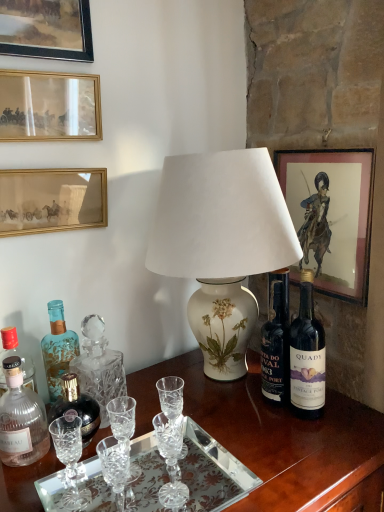
What do you see at coordinates (21, 419) in the screenshot? I see `translucent glass bottle at left, the third bottle viewed from the back` at bounding box center [21, 419].

What is the approximate width of wooden desk at center?

wooden desk at center is 26.33 inches in width.

The height and width of the screenshot is (512, 384). Describe the element at coordinates (212, 472) in the screenshot. I see `clear glass tray at lower center` at that location.

In order to face dark glass bottle at right, should I rotate leftwards or rightwards?

You should rotate right by 15.108 degrees.

Locate an element on the screen. blue glass bottle at left, the third bottle viewed from the front is located at coordinates (58, 349).

Identify the location of translucent glass bottle at left, marked as the 1th bottle in a front-to-back arrangement. (21, 419).

Is gold-framed picture at upper left, the 3th picture frame positioned from the left, looking in the opposite direction of wooden desk at center?

No, gold-framed picture at upper left, the 3th picture frame positioned from the left, is not facing away from wooden desk at center.

How far apart are gold-framed picture at upper left, arranged as the second picture frame when viewed from the right, and wooden desk at center?

gold-framed picture at upper left, arranged as the second picture frame when viewed from the right, and wooden desk at center are 23.17 inches apart from each other.

From the image's perspective, is gold-framed picture at upper left, the 3th picture frame positioned from the left, on wooden desk at center?

Indeed, from the image's perspective, gold-framed picture at upper left, the 3th picture frame positioned from the left, is shown above wooden desk at center.

Is clear crystal wine glass at center outside of gold-framed picture at upper left, the 3th picture frame positioned from the left?

clear crystal wine glass at center is positioned outside gold-framed picture at upper left, the 3th picture frame positioned from the left.

Is clear crystal wine glass at center at the left side of gold-framed picture at upper left, the 3th picture frame positioned from the left?

No, clear crystal wine glass at center is not to the left of gold-framed picture at upper left, the 3th picture frame positioned from the left.

Looking at their sizes, would you say clear crystal wine glass at center is wider or thinner than gold-framed picture at upper left, arranged as the second picture frame when viewed from the right?

Considering their sizes, clear crystal wine glass at center looks broader than gold-framed picture at upper left, arranged as the second picture frame when viewed from the right.

Is wooden picture frame at upper left, marked as the 4th picture frame in a right-to-left arrangement, completely or partially inside gold-framed picture at upper left, the 3th picture frame positioned from the left?

No, wooden picture frame at upper left, marked as the 4th picture frame in a right-to-left arrangement, is not surrounded by gold-framed picture at upper left, the 3th picture frame positioned from the left.

From a real-world perspective, between gold-framed picture at upper left, the 3th picture frame positioned from the left, and wooden picture frame at upper left, marked as the 4th picture frame in a right-to-left arrangement, who is vertically higher?

wooden picture frame at upper left, marked as the 4th picture frame in a right-to-left arrangement.

Is gold-framed picture at upper left, arranged as the second picture frame when viewed from the right, positioned behind wooden picture frame at upper left, marked as the 4th picture frame in a right-to-left arrangement?

That is True.

Is gold-framed picture at upper left, the 3th picture frame positioned from the left, to the left or to the right of wooden picture frame at upper left, marked as the 4th picture frame in a right-to-left arrangement, in the image?

gold-framed picture at upper left, the 3th picture frame positioned from the left, is positioned on wooden picture frame at upper left, marked as the 4th picture frame in a right-to-left arrangement,'s right side.

Is clear glass tray at lower center surrounding matte paper picture frame at upper right, acting as the 1th picture frame starting from the right?

No, matte paper picture frame at upper right, acting as the 1th picture frame starting from the right, is not surrounded by clear glass tray at lower center.

Is point (258, 485) positioned before point (323, 184)?

Yes, point (258, 485) is in front of point (323, 184).

In the scene shown: Is there a large distance between clear glass tray at lower center and matte paper picture frame at upper right, acting as the 4th picture frame starting from the left?

No, clear glass tray at lower center is not far from matte paper picture frame at upper right, acting as the 4th picture frame starting from the left.

How many degrees apart are the facing directions of clear glass tray at lower center and matte paper picture frame at upper right, acting as the 4th picture frame starting from the left?

87.5 degrees separate the facing orientations of clear glass tray at lower center and matte paper picture frame at upper right, acting as the 4th picture frame starting from the left.

From the picture: Measure the distance between translucent glass bottle at left, marked as the 1th bottle in a front-to-back arrangement, and matte paper picture frame at upper right, acting as the 4th picture frame starting from the left.

translucent glass bottle at left, marked as the 1th bottle in a front-to-back arrangement, is 32.05 inches away from matte paper picture frame at upper right, acting as the 4th picture frame starting from the left.

Is matte paper picture frame at upper right, acting as the 4th picture frame starting from the left, at the back of translucent glass bottle at left, the third bottle viewed from the back?

That's not correct — translucent glass bottle at left, the third bottle viewed from the back, is not looking away from matte paper picture frame at upper right, acting as the 4th picture frame starting from the left.

Based on the photo, is translucent glass bottle at left, marked as the 1th bottle in a front-to-back arrangement, situated inside matte paper picture frame at upper right, acting as the 1th picture frame starting from the right, or outside?

translucent glass bottle at left, marked as the 1th bottle in a front-to-back arrangement, cannot be found inside matte paper picture frame at upper right, acting as the 1th picture frame starting from the right.

Considering the sizes of translucent glass bottle at left, the third bottle viewed from the back, and matte paper picture frame at upper right, acting as the 4th picture frame starting from the left, in the image, is translucent glass bottle at left, the third bottle viewed from the back, bigger or smaller than matte paper picture frame at upper right, acting as the 4th picture frame starting from the left,?

Considering their sizes, translucent glass bottle at left, the third bottle viewed from the back, takes up less space than matte paper picture frame at upper right, acting as the 4th picture frame starting from the left.

Is clear glass tray at lower center smaller than gold-framed picture at upper left, arranged as the second picture frame when viewed from the right?

Incorrect, clear glass tray at lower center is not smaller in size than gold-framed picture at upper left, arranged as the second picture frame when viewed from the right.

Is clear glass tray at lower center not inside gold-framed picture at upper left, arranged as the second picture frame when viewed from the right?

Absolutely, clear glass tray at lower center is external to gold-framed picture at upper left, arranged as the second picture frame when viewed from the right.

Can you confirm if clear glass tray at lower center is positioned to the right of gold-framed picture at upper left, the 3th picture frame positioned from the left?

Yes, clear glass tray at lower center is to the right of gold-framed picture at upper left, the 3th picture frame positioned from the left.

Is clear glass tray at lower center in contact with gold-framed picture at upper left, the 3th picture frame positioned from the left?

No, clear glass tray at lower center is not next to gold-framed picture at upper left, the 3th picture frame positioned from the left.

Which of these two, wooden picture frame at upper left, marked as the 4th picture frame in a right-to-left arrangement, or clear glass tray at lower center, is smaller?

With smaller size is wooden picture frame at upper left, marked as the 4th picture frame in a right-to-left arrangement.

From the image's perspective, is wooden picture frame at upper left, arranged as the first picture frame when viewed from the left, under clear glass tray at lower center?

Incorrect, from the image's perspective, wooden picture frame at upper left, arranged as the first picture frame when viewed from the left, is higher than clear glass tray at lower center.

Based on the photo, is wooden picture frame at upper left, arranged as the first picture frame when viewed from the left, closer to the viewer compared to clear glass tray at lower center?

No, wooden picture frame at upper left, arranged as the first picture frame when viewed from the left, is further to the viewer.

Locate an element on the screen. picture frame that is the 3rd object located behind the wooden desk at center is located at coordinates (52, 200).

Find the location of `wine glass lying in front of the gold-framed picture at upper left, the 3th picture frame positioned from the left`. wine glass lying in front of the gold-framed picture at upper left, the 3th picture frame positioned from the left is located at coordinates point(172,400).

When comparing their distances from wooden picture frame at upper left, arranged as the first picture frame when viewed from the left, does matte glass picture frame at upper left, the 2th picture frame from the left, or blue glass bottle at left, the first bottle positioned from the back, seem closer?

The object closer to wooden picture frame at upper left, arranged as the first picture frame when viewed from the left, is matte glass picture frame at upper left, the 2th picture frame from the left.

Which object lies further to the anchor point clear crystal wine glass at center, matte glass bottle at center-left, arranged as the 2th bottle when viewed from the back, or matte glass picture frame at upper left, which ranks as the third picture frame in right-to-left order?

matte glass picture frame at upper left, which ranks as the third picture frame in right-to-left order, lies further to clear crystal wine glass at center than the other object.

Based on their spatial positions, is wooden desk at center or gold-framed picture at upper left, arranged as the second picture frame when viewed from the right, further from matte paper picture frame at upper right, acting as the 1th picture frame starting from the right?

gold-framed picture at upper left, arranged as the second picture frame when viewed from the right, is further to matte paper picture frame at upper right, acting as the 1th picture frame starting from the right.

Consider the image. From the image, which object appears to be farther from dark glass bottle at right, matte paper picture frame at upper right, acting as the 1th picture frame starting from the right, or clear crystal wine glass at center?

clear crystal wine glass at center lies further to dark glass bottle at right than the other object.

Considering their positions, is blue glass bottle at left, the third bottle viewed from the front, positioned closer to matte glass bottle at center-left, placed as the 2th bottle when sorted from front to back, than clear crystal wine glass at center?

Based on the image, blue glass bottle at left, the third bottle viewed from the front, appears to be nearer to matte glass bottle at center-left, placed as the 2th bottle when sorted from front to back.

When comparing their distances from dark glass bottle at right, does wooden desk at center or clear glass tray at lower center seem closer?

Based on the image, wooden desk at center appears to be nearer to dark glass bottle at right.

Considering their positions, is matte paper picture frame at upper right, acting as the 1th picture frame starting from the right, positioned further to translucent glass bottle at left, the third bottle viewed from the back, than matte glass bottle at center-left, placed as the 2th bottle when sorted from front to back?

Based on the image, matte paper picture frame at upper right, acting as the 1th picture frame starting from the right, appears to be further to translucent glass bottle at left, the third bottle viewed from the back.

Estimate the real-world distances between objects in this image. Which object is further from gold-framed picture at upper left, the 3th picture frame positioned from the left, clear glass tray at lower center or matte glass bottle at center-left, arranged as the 2th bottle when viewed from the back?

Based on the image, clear glass tray at lower center appears to be further to gold-framed picture at upper left, the 3th picture frame positioned from the left.

Where is `wine glass between wooden picture frame at upper left, marked as the 4th picture frame in a right-to-left arrangement, and clear glass tray at lower center, in the vertical direction`? The width and height of the screenshot is (384, 512). wine glass between wooden picture frame at upper left, marked as the 4th picture frame in a right-to-left arrangement, and clear glass tray at lower center, in the vertical direction is located at coordinates (172, 400).

Locate an element on the screen. glass plate between gold-framed picture at upper left, arranged as the second picture frame when viewed from the right, and dark glass bottle at right from left to right is located at coordinates (212, 472).

Where is `wine glass between translucent glass bottle at left, the third bottle viewed from the back, and dark glass bottle at right, in the horizontal direction`? This screenshot has width=384, height=512. wine glass between translucent glass bottle at left, the third bottle viewed from the back, and dark glass bottle at right, in the horizontal direction is located at coordinates (172, 400).

Locate an element on the screen. Image resolution: width=384 pixels, height=512 pixels. glass plate that lies between gold-framed picture at upper left, arranged as the second picture frame when viewed from the right, and wooden desk at center from top to bottom is located at coordinates pos(212,472).